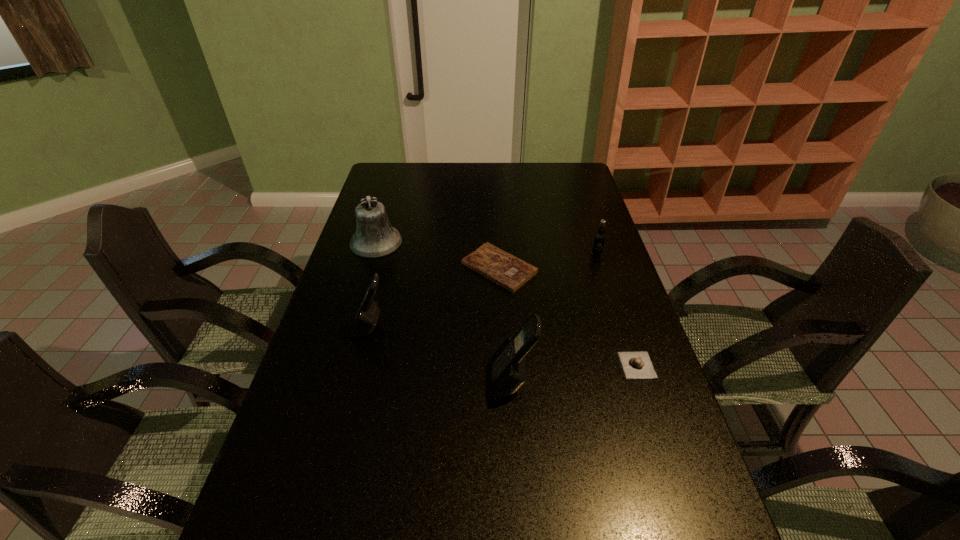
Identify the location of garlic present at the right edge. (636, 364).

Where is `free space at the far edge of the desktop`? The width and height of the screenshot is (960, 540). free space at the far edge of the desktop is located at coordinates (506, 174).

This screenshot has height=540, width=960. Find the location of `vacant space at the left edge`. vacant space at the left edge is located at coordinates (389, 259).

Identify the location of vacant region at the right edge of the desktop. Image resolution: width=960 pixels, height=540 pixels. (605, 277).

This screenshot has height=540, width=960. I want to click on vacant region at the far left corner of the desktop, so click(374, 177).

At what (x,y) coordinates should I click in order to perform the action: click on vacant area between the third shortest object and the fifth tallest object. Please return your answer as a coordinate pair (x, y). The height and width of the screenshot is (540, 960). Looking at the image, I should click on (x=616, y=309).

Locate an element on the screen. vacant area that lies between the bell and the tallest object is located at coordinates (444, 312).

Locate an element on the screen. This screenshot has height=540, width=960. empty space between the shorter cellular telephone and the taller cellular telephone is located at coordinates (441, 355).

You are a GUI agent. You are given a task and a screenshot of the screen. Output one action in this format:
    pyautogui.click(x=<x>, y=<y>)
    Task: Click on the free space between the bell and the Bible
    The image size is (960, 540).
    Given the screenshot: What is the action you would take?
    (438, 255)

Find the location of a particular element. This screenshot has width=960, height=540. vacant space that is in between the fourth farthest object and the root beer is located at coordinates (483, 291).